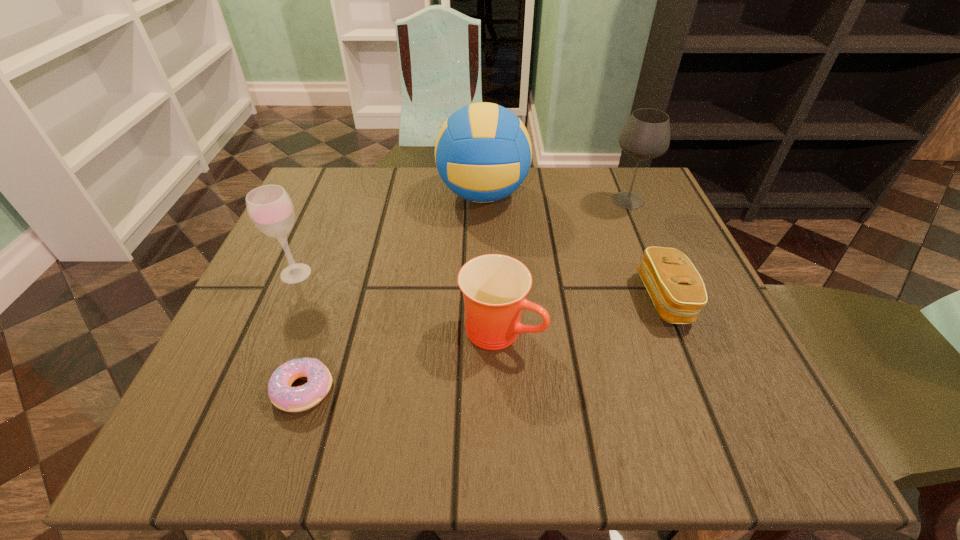
Find the location of a particular element. vacant region located on the back of the left wineglass is located at coordinates (334, 186).

Locate an element on the screen. This screenshot has height=540, width=960. blank area located 0.120m on the left of the third shortest object is located at coordinates (388, 330).

Locate an element on the screen. The image size is (960, 540). vacant space situated on the zipper side of the second shortest object is located at coordinates (502, 299).

Identify the location of vacant area situated on the zipper side of the second shortest object. Image resolution: width=960 pixels, height=540 pixels. (496, 299).

I want to click on blank area located on the zipper side of the second shortest object, so click(x=480, y=299).

Identify the location of free space located 0.370m on the right of the second object from left to right. This screenshot has width=960, height=540. (583, 389).

Find the location of a particular element. Image resolution: width=960 pixels, height=540 pixels. volleyball that is at the far edge is located at coordinates (483, 152).

The image size is (960, 540). Find the location of `wineglass that is at the far edge`. wineglass that is at the far edge is located at coordinates (646, 135).

Where is `object at the near edge`? This screenshot has width=960, height=540. object at the near edge is located at coordinates (291, 399).

At what (x,y) coordinates should I click in order to perform the action: click on wineglass present at the left edge. Please return your answer as a coordinate pair (x, y). Looking at the image, I should click on (270, 208).